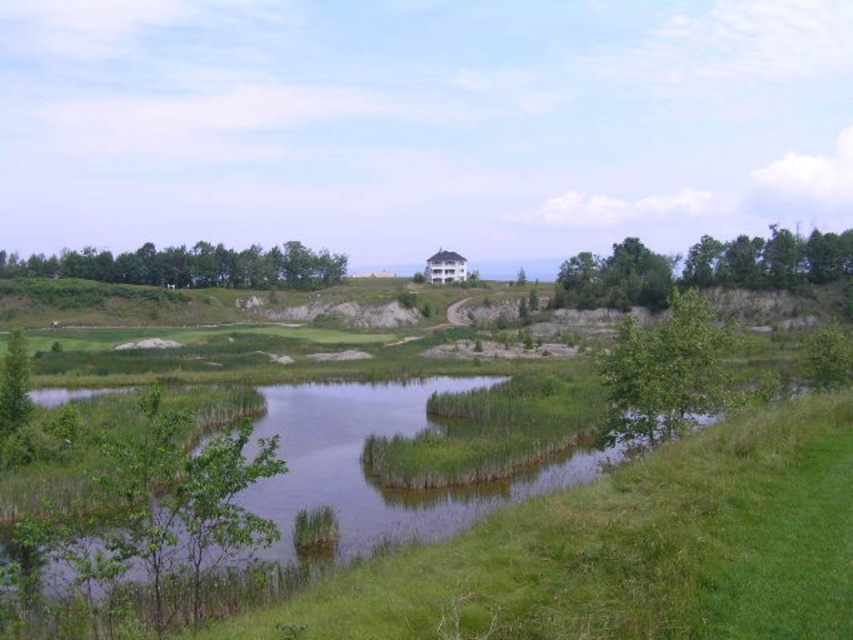
Does green leafy tree at lower right appear on the left side of green leafy trees at upper left?

In fact, green leafy tree at lower right is to the right of green leafy trees at upper left.

Who is lower down, green leafy tree at lower right or green leafy trees at upper left?

green leafy tree at lower right is below.

Find the location of a particular element. green leafy tree at lower right is located at coordinates (666, 371).

Where is `green leafy tree at lower right`? This screenshot has height=640, width=853. green leafy tree at lower right is located at coordinates (666, 371).

Can you confirm if green leafy trees at right is bigger than green leafy tree at lower right?

Incorrect, green leafy trees at right is not larger than green leafy tree at lower right.

Is point (556, 296) positioned after point (631, 371)?

Yes.

Between point (560, 268) and point (689, 388), which one is positioned behind?

Positioned behind is point (560, 268).

Find the location of a particular element. This screenshot has width=853, height=640. green leafy trees at right is located at coordinates (701, 268).

Consider the image. Is green leafy trees at right above green leafy trees at upper left?

No.

In the scene shown: Which is above, green leafy trees at right or green leafy trees at upper left?

green leafy trees at upper left is higher up.

Locate an element on the screen. This screenshot has height=640, width=853. green leafy trees at right is located at coordinates (701, 268).